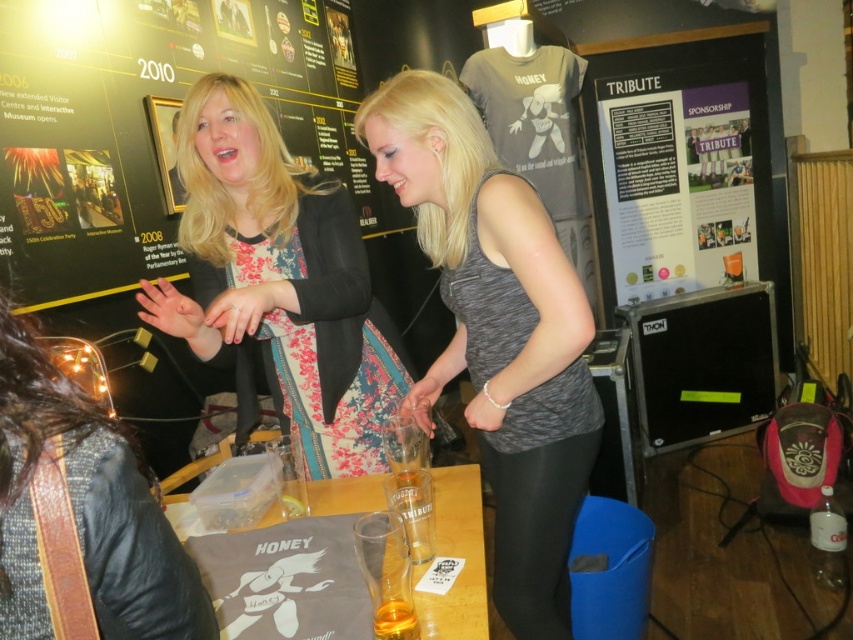
Is gray matte tank top at center closer to the viewer compared to white paper at upper center?

Yes, it is in front of white paper at upper center.

Does gray matte tank top at center appear under white paper at upper center?

Yes.

The image size is (853, 640). I want to click on gray matte tank top at center, so click(498, 333).

Find the location of a particular element. gray matte tank top at center is located at coordinates (498, 333).

Is the position of floral fabric dress at center less distant than that of translucent plastic cup at lower center?

No, it is not.

Does floral fabric dress at center appear on the right side of translucent plastic cup at lower center?

Incorrect, floral fabric dress at center is not on the right side of translucent plastic cup at lower center.

Find the location of `floral fabric dress at center`. floral fabric dress at center is located at coordinates (277, 284).

Is point (312, 340) positioned in front of point (643, 118)?

Yes, it is in front of point (643, 118).

Can you confirm if floral fabric dress at center is smaller than white paper at upper center?

Incorrect, floral fabric dress at center is not smaller in size than white paper at upper center.

Is point (300, 433) closer to viewer compared to point (618, 243)?

Yes, point (300, 433) is closer to viewer.

The image size is (853, 640). I want to click on floral fabric dress at center, so click(x=277, y=284).